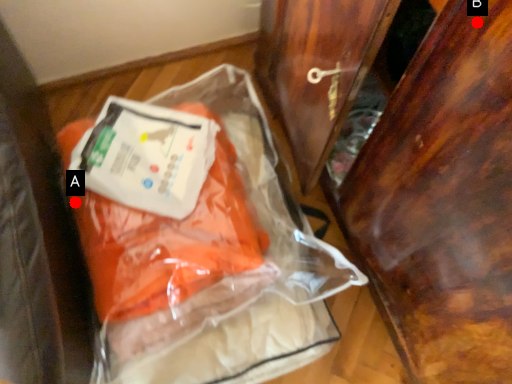
Question: Two points are circled on the image, labeled by A and B beside each circle. Which of the following is the farthest from the observer?

Choices:
 (A) A is further
 (B) B is further

Answer: (A)